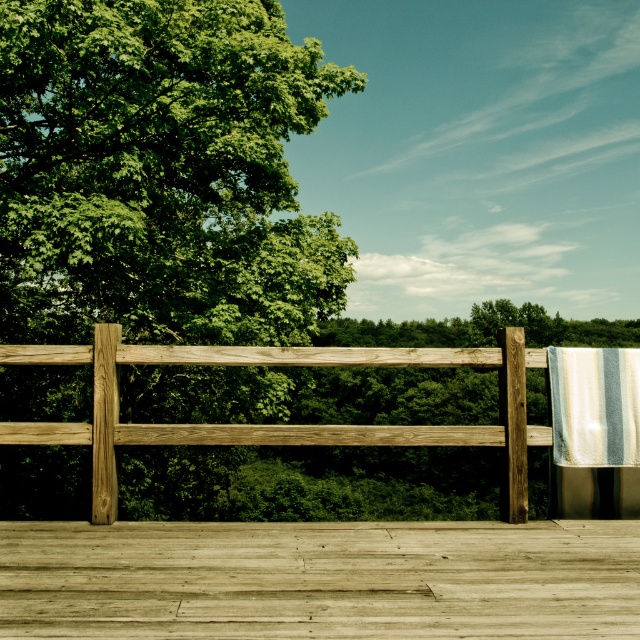
You are standing on the wooden deck at center and looking towards the green matte wood at left. Which object is taller from your perspective?

The green matte wood at left is much taller than the wooden deck at center from your perspective.

You are planning to place a 1.2 meter wide bench on the wooden deck. The wooden deck has two available spots next to the wooden fence at center and the striped fabric at right. Based on their widths, which spot can accommodate the bench?

The wooden fence at center has a larger width than the striped fabric at right, so the bench can be placed next to the wooden fence at center as it provides enough space.